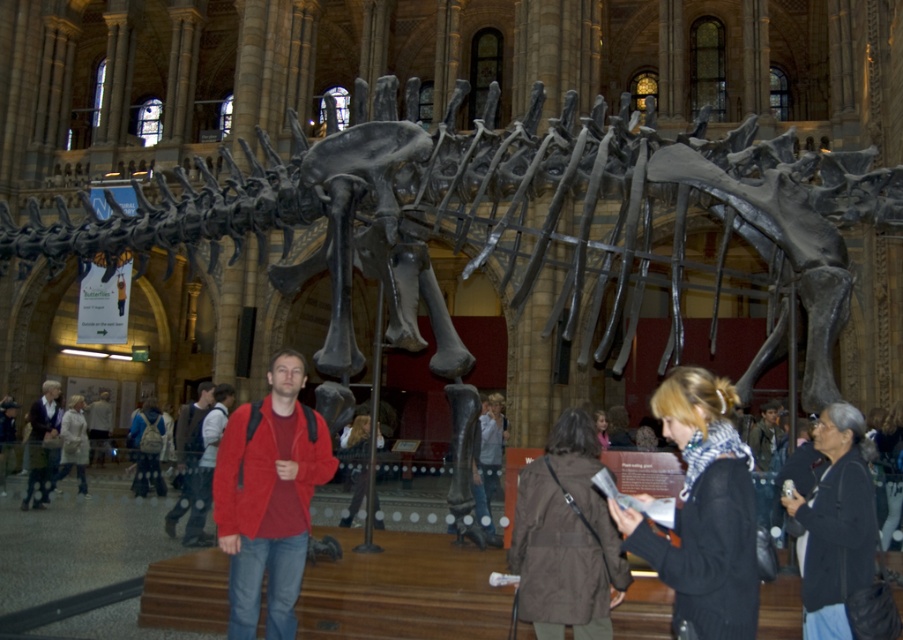
The width and height of the screenshot is (903, 640). I want to click on suede red jacket at center, so click(x=268, y=497).

Is suede red jacket at center below red sweater at center?

Incorrect, suede red jacket at center is not positioned below red sweater at center.

I want to click on suede red jacket at center, so click(x=268, y=497).

You are a GUI agent. You are given a task and a screenshot of the screen. Output one action in this format:
    pyautogui.click(x=<x>, y=<y>)
    Task: Click on the suede red jacket at center
    The image size is (903, 640).
    Given the screenshot: What is the action you would take?
    pyautogui.click(x=268, y=497)

Looking at this image, is suede red jacket at center below light brown leather jacket at center?

Incorrect, suede red jacket at center is not positioned below light brown leather jacket at center.

Where is `suede red jacket at center`? The width and height of the screenshot is (903, 640). suede red jacket at center is located at coordinates (268, 497).

The width and height of the screenshot is (903, 640). I want to click on denim jacket at center, so [x=147, y=448].

Find the location of a particular element. The height and width of the screenshot is (640, 903). denim jacket at center is located at coordinates (147, 448).